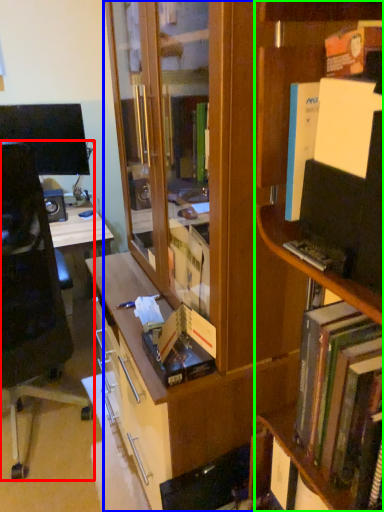
Question: Which object is the farthest from chair (highlighted by a red box)? Choose among these: bookcase (highlighted by a blue box) or shelf (highlighted by a green box).

Choices:
 (A) bookcase
 (B) shelf

Answer: (B)